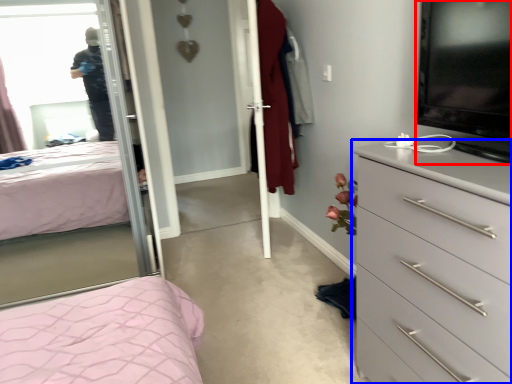
Question: Which object appears closest to the camera in this image, television (highlighted by a red box) or chest of drawers (highlighted by a blue box)?

Choices:
 (A) television
 (B) chest of drawers

Answer: (B)